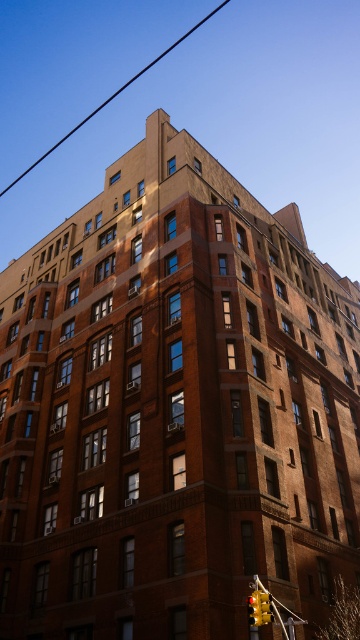
Between point (5, 188) and point (262, 609), which one is positioned behind?

The point (5, 188) is more distant.

Between metallic wire at upper center and yellow matte traffic light at lower right, which one appears on the left side from the viewer's perspective?

metallic wire at upper center is more to the left.

The image size is (360, 640). Find the location of `metallic wire at upper center`. metallic wire at upper center is located at coordinates (114, 96).

I want to click on metallic wire at upper center, so click(x=114, y=96).